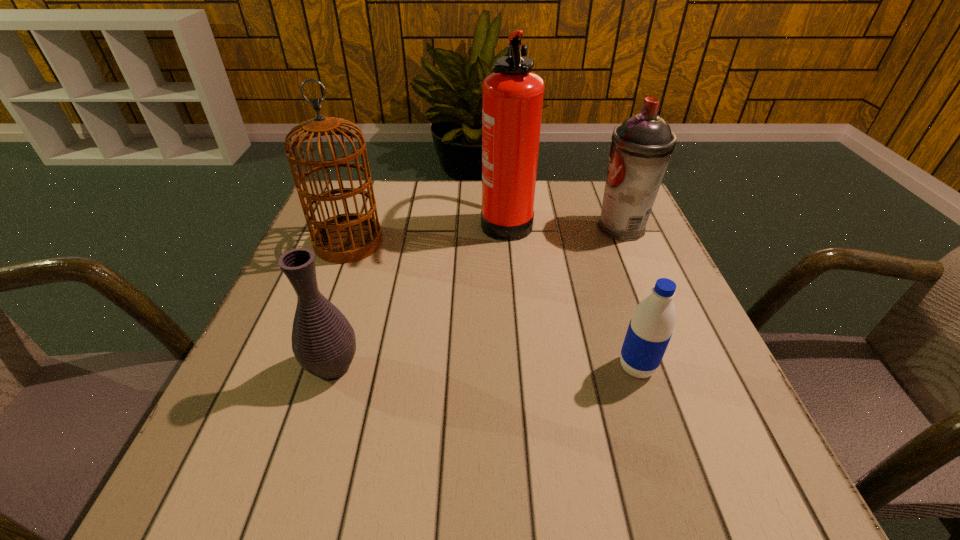
At what (x,y) coordinates should I click in order to perform the action: click on the tallest object. Please return your answer as a coordinate pair (x, y). The image size is (960, 540). Looking at the image, I should click on (512, 96).

At what (x,y) coordinates should I click in order to perform the action: click on the third object from left to right. Please return your answer as a coordinate pair (x, y). The height and width of the screenshot is (540, 960). Looking at the image, I should click on (512, 96).

This screenshot has height=540, width=960. In order to click on birdcage in this screenshot , I will do click(345, 238).

Where is `the third tallest object`? the third tallest object is located at coordinates (641, 147).

Image resolution: width=960 pixels, height=540 pixels. In order to click on the fourth tallest object in this screenshot , I will do `click(323, 341)`.

This screenshot has height=540, width=960. I want to click on the shortest object, so click(x=650, y=329).

The image size is (960, 540). Find the location of `vacant space located 0.380m at the nozzle of the fire extinguisher`. vacant space located 0.380m at the nozzle of the fire extinguisher is located at coordinates (331, 219).

Identify the location of free space located 0.070m at the nozzle of the fire extinguisher. This screenshot has height=540, width=960. (453, 219).

Locate an element on the screen. free spot located at the nozzle of the fire extinguisher is located at coordinates (398, 219).

Locate an element on the screen. vacant space located 0.120m on the right of the fourth shortest object is located at coordinates (433, 242).